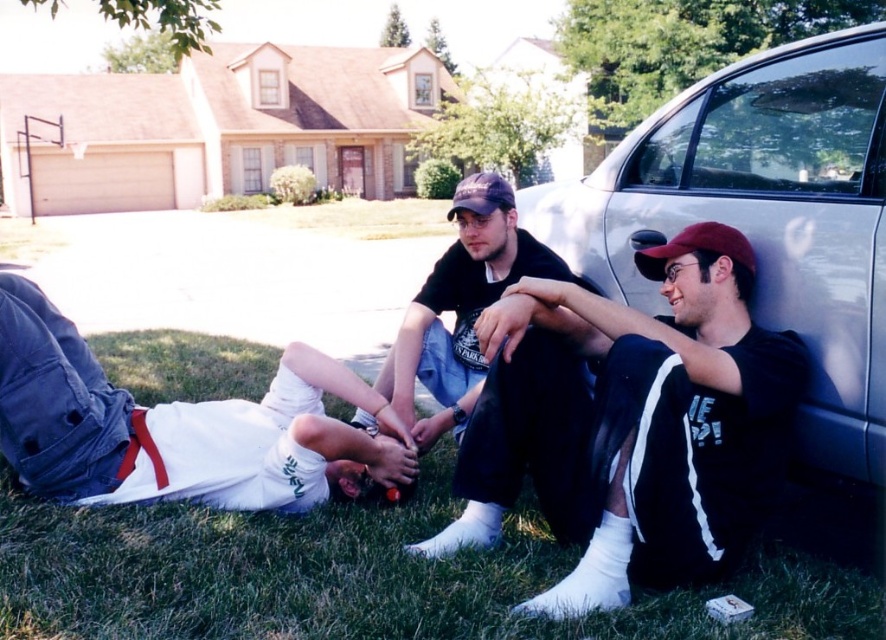
You are standing on the grass and looking at the green grass at lower center and the white cotton shirt at lower left. Which one is taller?

The white cotton shirt at lower left is taller than the green grass at lower center.